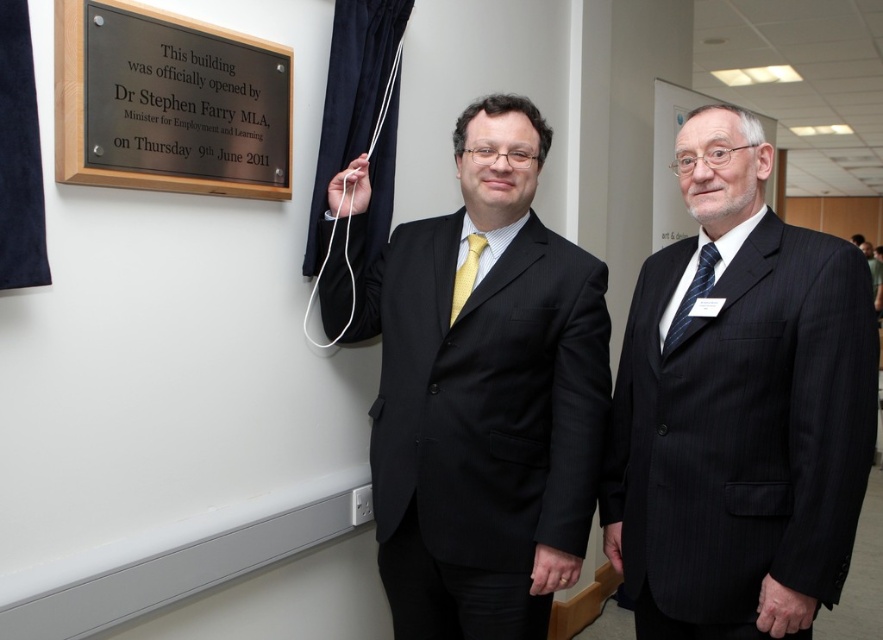
Is point (343, 310) less distant than point (251, 192)?

No, (343, 310) is behind (251, 192).

Which is above, black pinstripe suit at center or black polished plaque at upper left?

Positioned higher is black polished plaque at upper left.

The height and width of the screenshot is (640, 883). I want to click on black pinstripe suit at center, so click(x=484, y=396).

Who is higher up, dark pinstripe suit at right or blue striped tie at right?

blue striped tie at right is higher up.

Describe the element at coordinates (740, 410) in the screenshot. I see `dark pinstripe suit at right` at that location.

Find the location of a particular element. Image resolution: width=883 pixels, height=640 pixels. dark pinstripe suit at right is located at coordinates (x=740, y=410).

Can you confirm if dark pinstripe suit at right is shorter than black polished plaque at upper left?

In fact, dark pinstripe suit at right may be taller than black polished plaque at upper left.

Is dark pinstripe suit at right thinner than black polished plaque at upper left?

In fact, dark pinstripe suit at right might be wider than black polished plaque at upper left.

Between point (689, 580) and point (111, 150), which one is positioned behind?

Point (111, 150)

You are a GUI agent. You are given a task and a screenshot of the screen. Output one action in this format:
    pyautogui.click(x=<x>, y=<y>)
    Task: Click on the dark pinstripe suit at right
    The width and height of the screenshot is (883, 640).
    Given the screenshot: What is the action you would take?
    pyautogui.click(x=740, y=410)